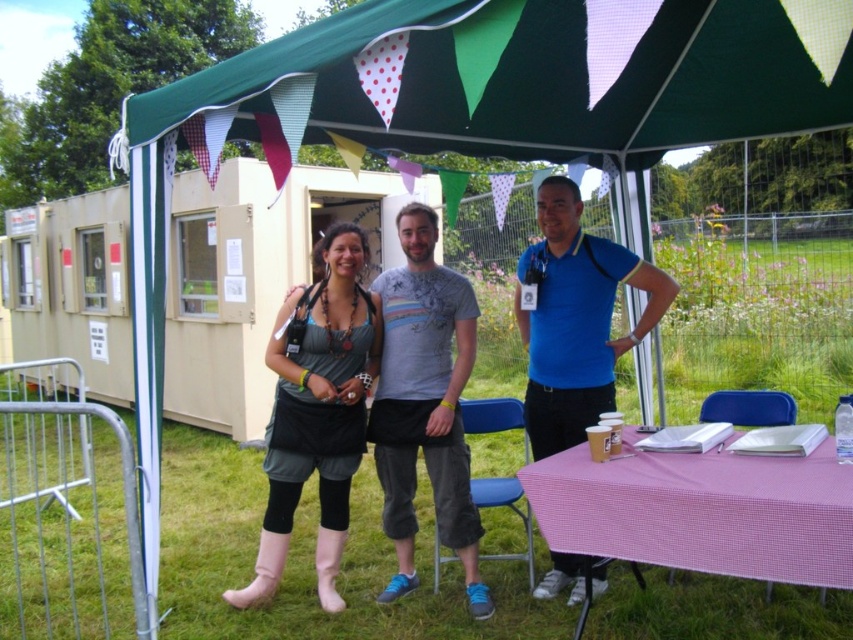
You are planning to set up an umbrella for shade at the picnic area. The picnic area has a green fabric canopy at upper center and a pink checkered table at lower right. Which object should you place the umbrella over to provide shade for the table?

The green fabric canopy at upper center is already located above the pink checkered table at lower right, so the umbrella is unnecessary as the canopy is already providing shade.

Consider the image. You are planning to hang a string of fairy lights from the highest point in the scene. Which object between the green fabric canopy at upper center and the pink checkered table at lower right should you choose?

The green fabric canopy at upper center has a greater height compared to the pink checkered table at lower right, so you should choose the green fabric canopy at upper center to hang the fairy lights from its highest point.

You are a photographer positioned behind the group of people under the canopy. You want to capture a photo where the pink rubber boots at lower left are visible next to the blue cotton polo shirt at center. Based on their positions, is this possible?

Yes, because the pink rubber boots at lower left are positioned to the left of the blue cotton polo shirt at center, they can be captured in the same frame next to each other.